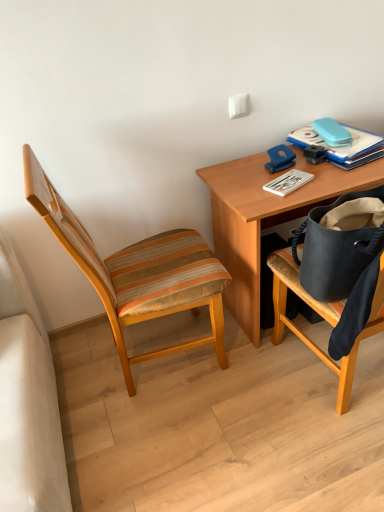
The image size is (384, 512). Identify the location of vacant space underneath wooden striped chair at left (from a real-world perspective). [172, 361].